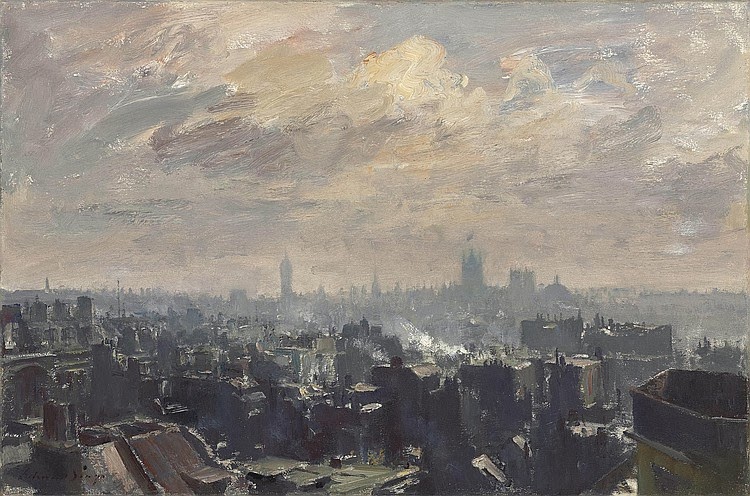
What are the coordinates of `gallery art` in the screenshot? It's located at (390, 298).